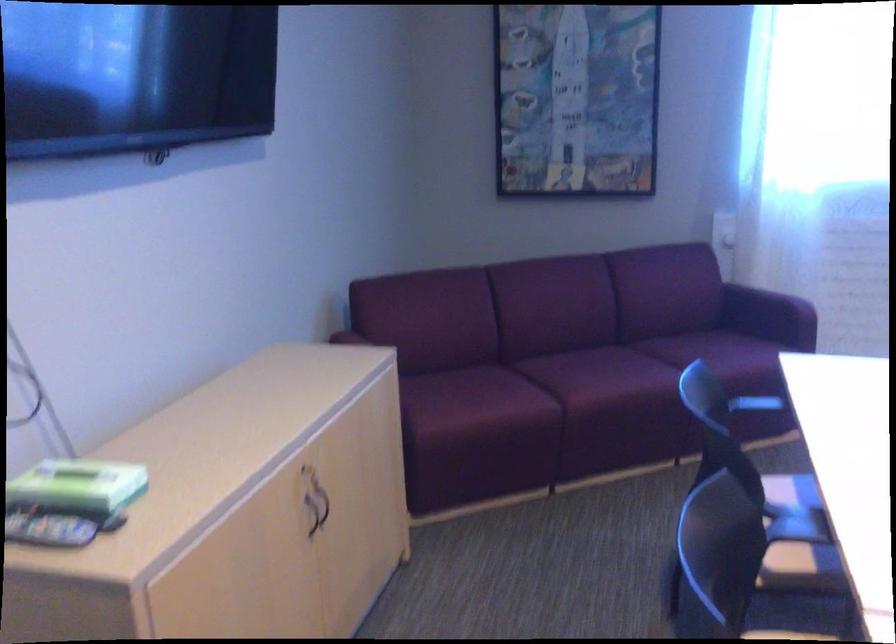
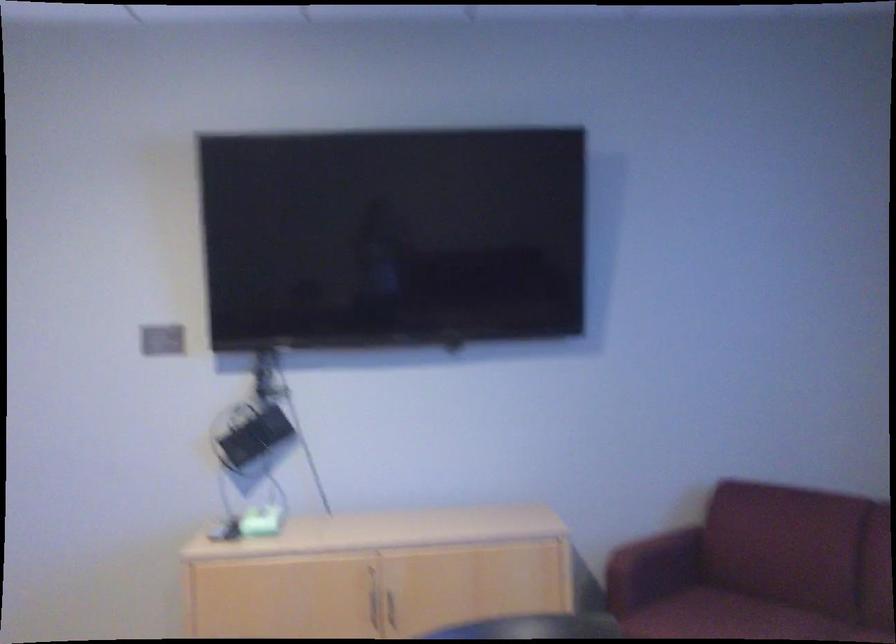
In the second image, find the point that corresponds to [469,384] in the first image.

(722, 616)